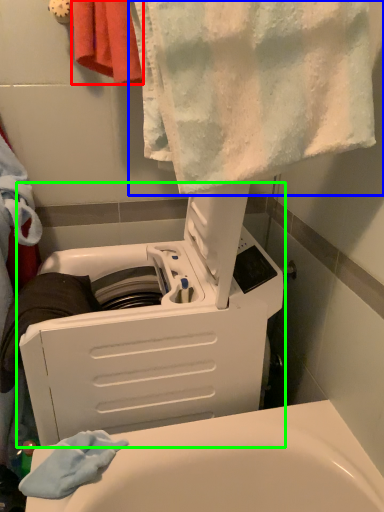
Question: Estimate the real-world distances between objects in this image. Which object is farther from towel (highlighted by a red box), towel (highlighted by a blue box) or appliance (highlighted by a green box)?

Choices:
 (A) towel
 (B) appliance

Answer: (B)